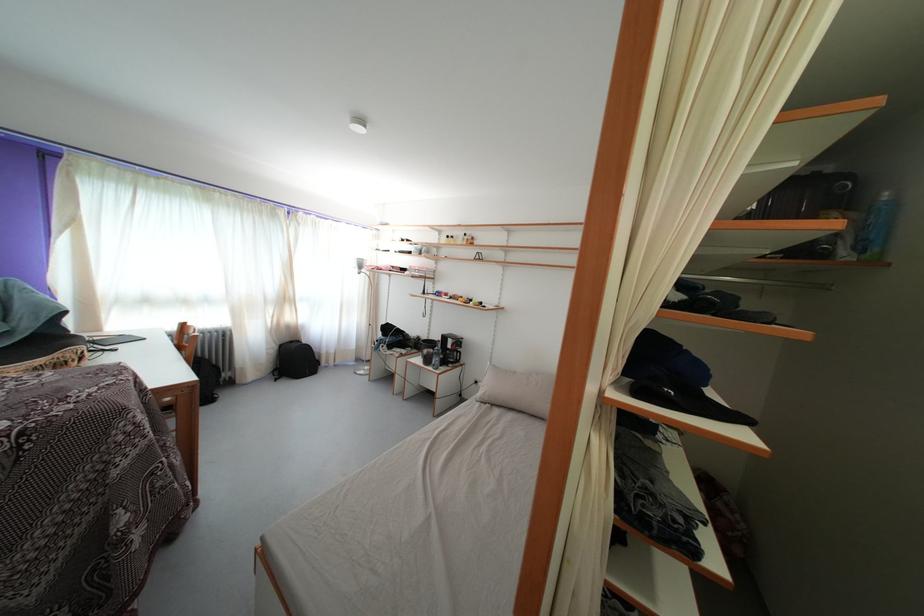
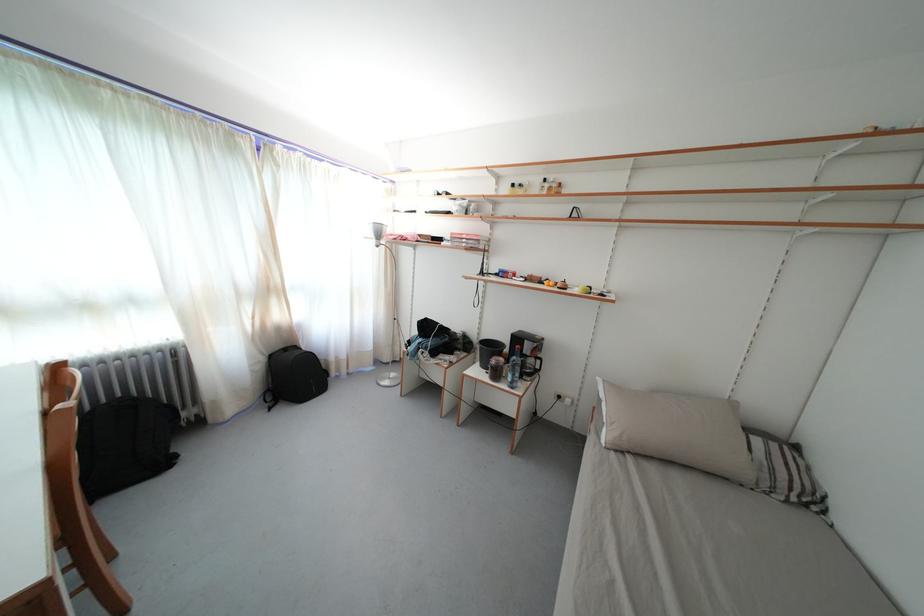
Where in the second image is the point corresponding to (x=436, y=344) from the first image?

(491, 341)